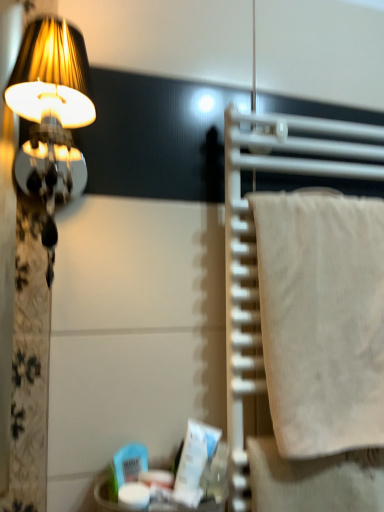
Question: From the image's perspective, is white cotton towel at right below matte gold lampshade at left?

Choices:
 (A) yes
 (B) no

Answer: (A)

Question: From a real-world perspective, is white cotton towel at right physically above matte gold lampshade at left?

Choices:
 (A) no
 (B) yes

Answer: (A)

Question: Considering the relative sizes of white cotton towel at right and matte gold lampshade at left in the image provided, is white cotton towel at right taller than matte gold lampshade at left?

Choices:
 (A) yes
 (B) no

Answer: (A)

Question: Does white cotton towel at right have a lesser height compared to matte gold lampshade at left?

Choices:
 (A) no
 (B) yes

Answer: (A)

Question: Is white cotton towel at right to the left of matte gold lampshade at left from the viewer's perspective?

Choices:
 (A) no
 (B) yes

Answer: (A)

Question: Is white cotton towel at right placed right next to matte gold lampshade at left?

Choices:
 (A) no
 (B) yes

Answer: (A)

Question: Is the depth of matte gold lampshade at left greater than that of white cotton towel at right?

Choices:
 (A) no
 (B) yes

Answer: (A)

Question: Is matte gold lampshade at left bigger than white cotton towel at right?

Choices:
 (A) yes
 (B) no

Answer: (B)

Question: Can you confirm if matte gold lampshade at left is shorter than white cotton towel at right?

Choices:
 (A) no
 (B) yes

Answer: (B)

Question: Does matte gold lampshade at left have a lesser width compared to white cotton towel at right?

Choices:
 (A) yes
 (B) no

Answer: (B)

Question: From the image's perspective, is matte gold lampshade at left under white cotton towel at right?

Choices:
 (A) yes
 (B) no

Answer: (B)

Question: Considering the relative sizes of matte gold lampshade at left and white cotton towel at right in the image provided, is matte gold lampshade at left wider than white cotton towel at right?

Choices:
 (A) yes
 (B) no

Answer: (A)

Question: Is white cotton towel at right in front of or behind matte gold lampshade at left in the image?

Choices:
 (A) behind
 (B) front

Answer: (A)